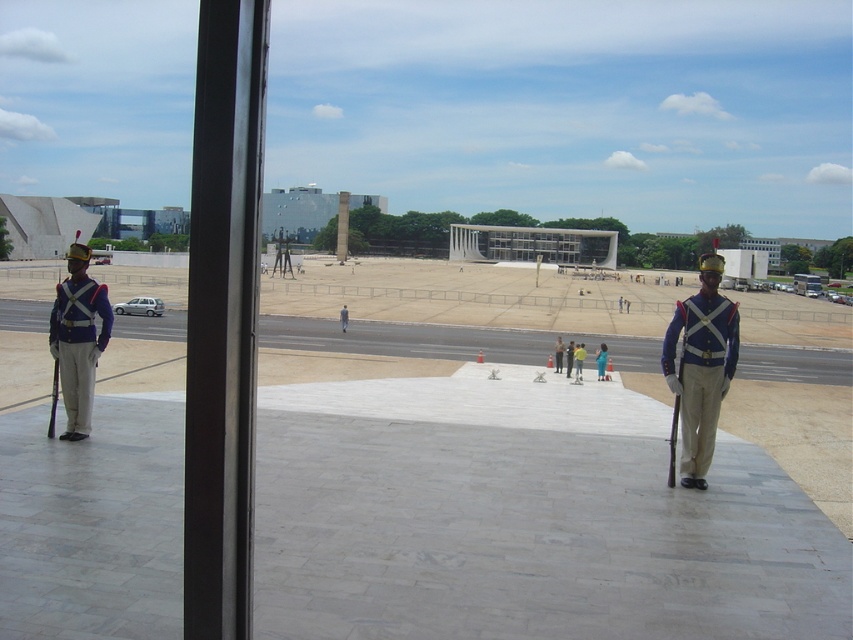
Question: Is shiny blue fabric uniform at right to the left of shiny blue uniform at left from the viewer's perspective?

Choices:
 (A) no
 (B) yes

Answer: (A)

Question: Which point is farther to the camera?

Choices:
 (A) blue uniformed guard at center
 (B) blue uniformed person at center

Answer: (B)

Question: Is shiny blue fabric uniform at right to the left of blue uniformed person at center from the viewer's perspective?

Choices:
 (A) yes
 (B) no

Answer: (A)

Question: Which point is closer to the camera taking this photo?

Choices:
 (A) (601, 344)
 (B) (583, 356)
 (C) (683, 428)
 (D) (561, 369)

Answer: (C)

Question: Which object is positioned closest to the blue uniformed person at center?

Choices:
 (A) blue uniformed guard at center
 (B) shiny blue fabric uniform at right
 (C) shiny blue uniform at left

Answer: (A)

Question: Can you confirm if shiny blue fabric uniform at right is thinner than blue uniformed guard at center?

Choices:
 (A) yes
 (B) no

Answer: (A)